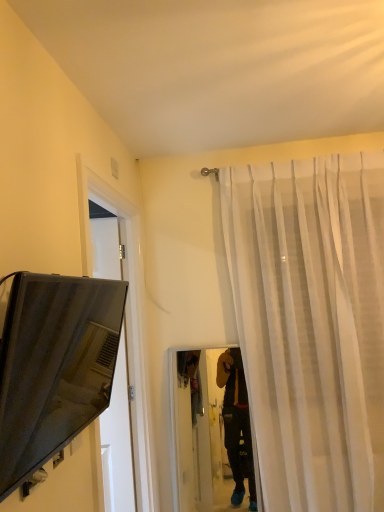
In order to click on white sheer curtain at upper right in this screenshot , I will do pyautogui.click(x=311, y=324).

The image size is (384, 512). What do you see at coordinates (311, 324) in the screenshot?
I see `white sheer curtain at upper right` at bounding box center [311, 324].

This screenshot has width=384, height=512. What do you see at coordinates (54, 366) in the screenshot? I see `matte black tv at left` at bounding box center [54, 366].

Identify the location of matte black tv at left. (54, 366).

Identify the location of white sheer curtain at upper right. (311, 324).

Which object is positioned more to the left, matte black tv at left or white sheer curtain at upper right?

From the viewer's perspective, matte black tv at left appears more on the left side.

Considering their positions, is matte black tv at left located in front of or behind white sheer curtain at upper right?

Clearly, matte black tv at left is in front of white sheer curtain at upper right.

Between point (29, 277) and point (367, 211), which one is positioned in front?

The point (29, 277) is closer to the camera.

From the image's perspective, which object appears higher, matte black tv at left or white sheer curtain at upper right?

matte black tv at left appears higher in the image.

From a real-world perspective, which object stands above the other?

From a 3D spatial view, matte black tv at left is above.

Considering the sizes of objects matte black tv at left and white sheer curtain at upper right in the image provided, who is thinner, matte black tv at left or white sheer curtain at upper right?

With smaller width is matte black tv at left.

Who is shorter, matte black tv at left or white sheer curtain at upper right?

matte black tv at left.

Considering the relative sizes of matte black tv at left and white sheer curtain at upper right in the image provided, is matte black tv at left bigger than white sheer curtain at upper right?

No.

Does matte black tv at left contain white sheer curtain at upper right?

No, white sheer curtain at upper right is located outside of matte black tv at left.

Is matte black tv at left far away from white sheer curtain at upper right?

Yes.

Is matte black tv at left oriented away from white sheer curtain at upper right?

matte black tv at left is not turned away from white sheer curtain at upper right.

Consider the image. How distant is matte black tv at left from white sheer curtain at upper right?

matte black tv at left is 1.28 meters away from white sheer curtain at upper right.

Where is `curtain located underneath the matte black tv at left (from a real-world perspective)`? The height and width of the screenshot is (512, 384). curtain located underneath the matte black tv at left (from a real-world perspective) is located at coordinates (311, 324).

Is white sheer curtain at upper right to the left of matte black tv at left from the viewer's perspective?

No.

Is white sheer curtain at upper right closer to camera compared to matte black tv at left?

No, white sheer curtain at upper right is further to the viewer.

Considering the positions of points (369, 271) and (33, 454), is point (369, 271) farther from camera compared to point (33, 454)?

Yes.

From the image's perspective, which is above, white sheer curtain at upper right or matte black tv at left?

matte black tv at left is shown above in the image.

From a real-world perspective, is white sheer curtain at upper right located beneath matte black tv at left?

Yes, from a real-world perspective, white sheer curtain at upper right is beneath matte black tv at left.

From the picture: Does white sheer curtain at upper right have a greater width compared to matte black tv at left?

Yes.

Can you confirm if white sheer curtain at upper right is shorter than matte black tv at left?

Incorrect, the height of white sheer curtain at upper right does not fall short of that of matte black tv at left.

Considering the relative sizes of white sheer curtain at upper right and matte black tv at left in the image provided, is white sheer curtain at upper right bigger than matte black tv at left?

Correct, white sheer curtain at upper right is larger in size than matte black tv at left.

Choose the correct answer: Is white sheer curtain at upper right inside matte black tv at left or outside it?

white sheer curtain at upper right cannot be found inside matte black tv at left.

Is there a large distance between white sheer curtain at upper right and matte black tv at left?

white sheer curtain at upper right is far away from matte black tv at left.

Is white sheer curtain at upper right facing away from matte black tv at left?

white sheer curtain at upper right does not have its back to matte black tv at left.

What's the angular difference between white sheer curtain at upper right and matte black tv at left's facing directions?

The angle between the facing direction of white sheer curtain at upper right and the facing direction of matte black tv at left is 91.3 degrees.

Where is `television above the white sheer curtain at upper right (from the image's perspective)`? This screenshot has width=384, height=512. television above the white sheer curtain at upper right (from the image's perspective) is located at coordinates (54, 366).

Locate an element on the screen. television above the white sheer curtain at upper right (from a real-world perspective) is located at coordinates (54, 366).

Find the location of a particular element. The image size is (384, 512). television in front of the white sheer curtain at upper right is located at coordinates (54, 366).